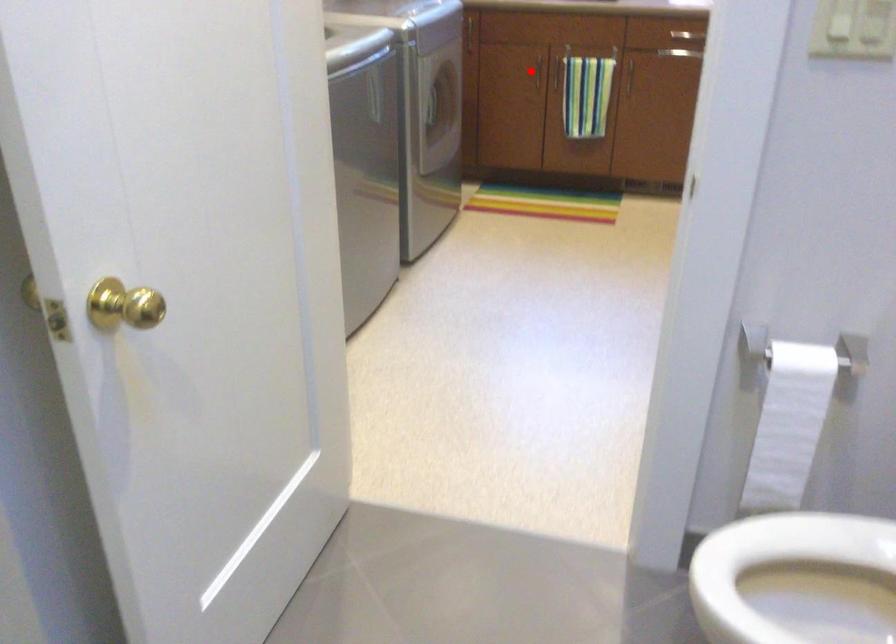
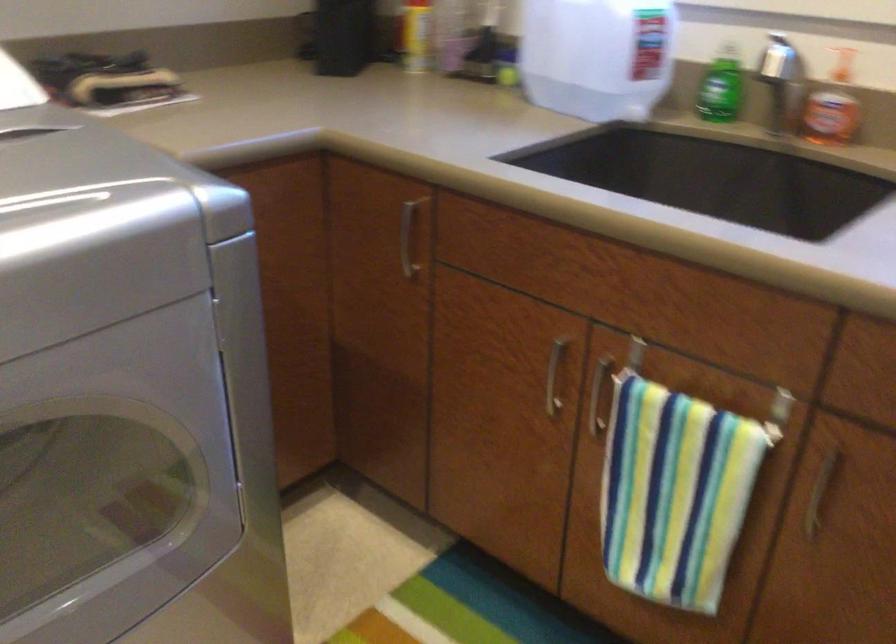
Question: I am providing you with two images of the same scene from different viewpoints. In image1, a red point is highlighted. Considering the same 3D point in image2, which of the following is correct?

Choices:
 (A) It is closer
 (B) It is farther

Answer: (A)